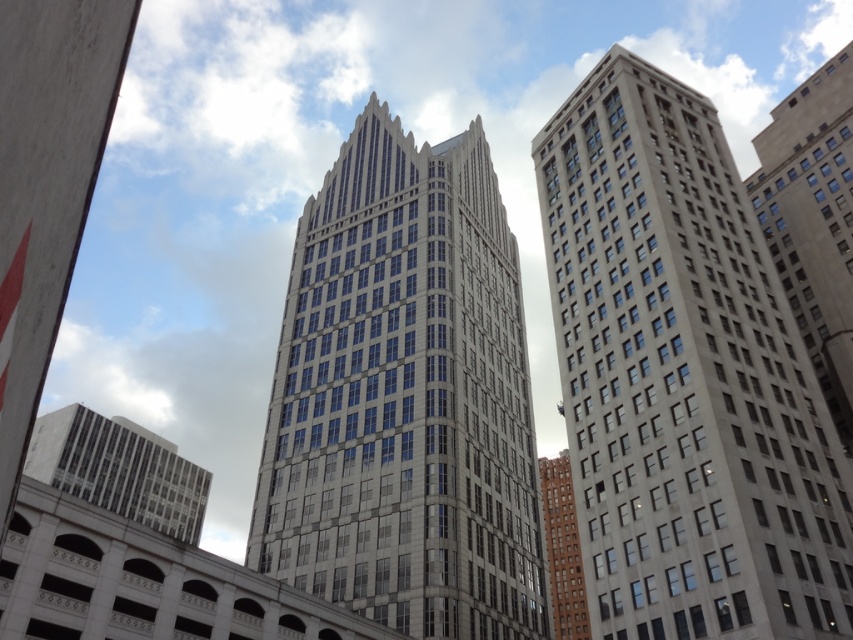
You are an architect comparing two buildings in the city. You see the gray stone building at right and the gray stone skyscraper at center. Which one is taller?

The gray stone skyscraper at center is taller than the gray stone building at right.

You are a delivery drone carrying a package that requires a minimum of 70 feet of clearance between two buildings to safely pass through. You need to fly between the gray stone building at right and the gray stone skyscraper at center. Can you safely navigate through this gap?

The gray stone building at right is 71.51 feet away from the gray stone skyscraper at center, which is just above the required 70 feet clearance. Therefore, the delivery drone can safely navigate through the gap between them.